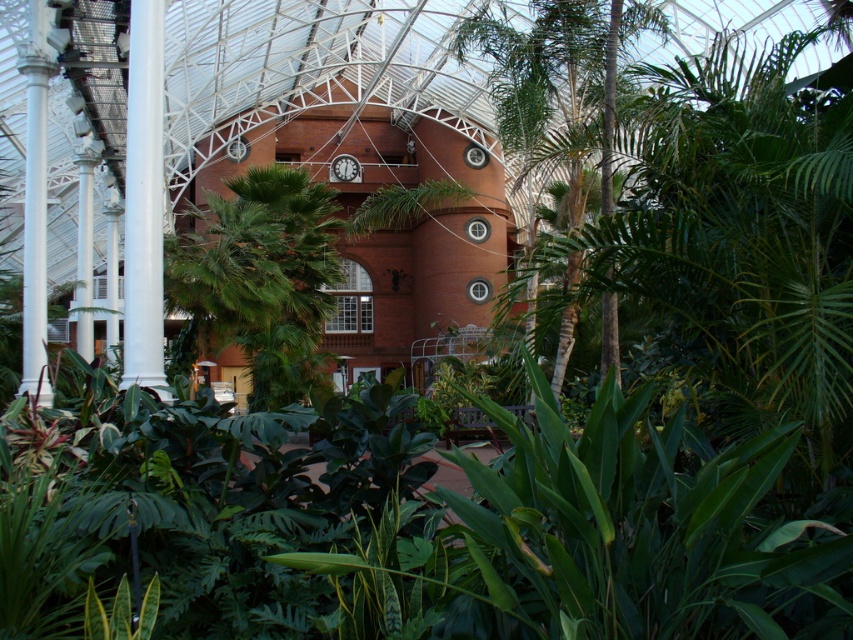
You are standing in the greenhouse and want to locate the point at coordinates (x=257, y=280). Based on the scene description, where exactly would this point be located?

The point at coordinates (x=257, y=280) is on the green leafy palm at center.

You are a gardener in the greenhouse and need to prune the tallest plant between the green leafy palm at center and the green leafy tree at center. Which one should you choose?

The green leafy tree at center is taller than the green leafy palm at center, so you should prune the green leafy tree at center.

You are a gardener who needs to water the plants in the greenhouse. You have a watering can that can reach up to 2 meters. The green leafy palm at center is 1.5 meters tall and the green leafy tree at center is 3 meters tall. Can you water both plants without moving the watering can?

The green leafy palm at center is 1.5 meters tall, which is within the watering can reach of 2 meters. However, the green leafy tree at center is 3 meters tall, exceeding the watering can reach. Therefore, you can water the green leafy palm at center but not the green leafy tree at center without moving the watering can.